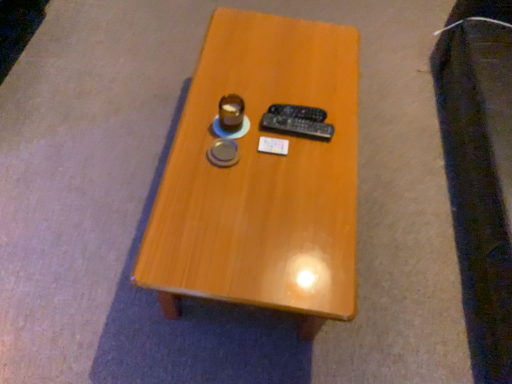
The width and height of the screenshot is (512, 384). Identify the location of vacant area located to the right-hand side of black plastic remote control at center, which is counted as the second remote control, starting from the back. (335, 135).